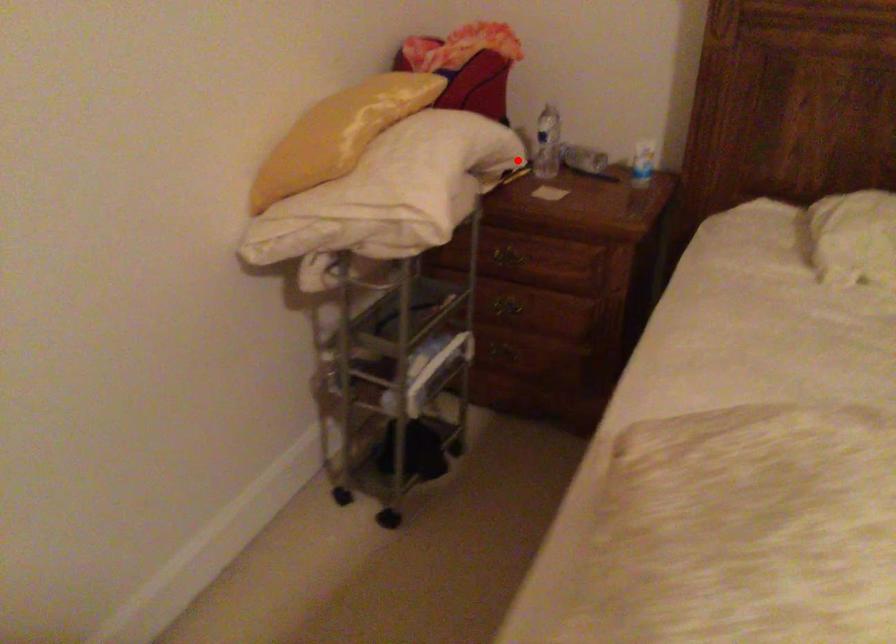
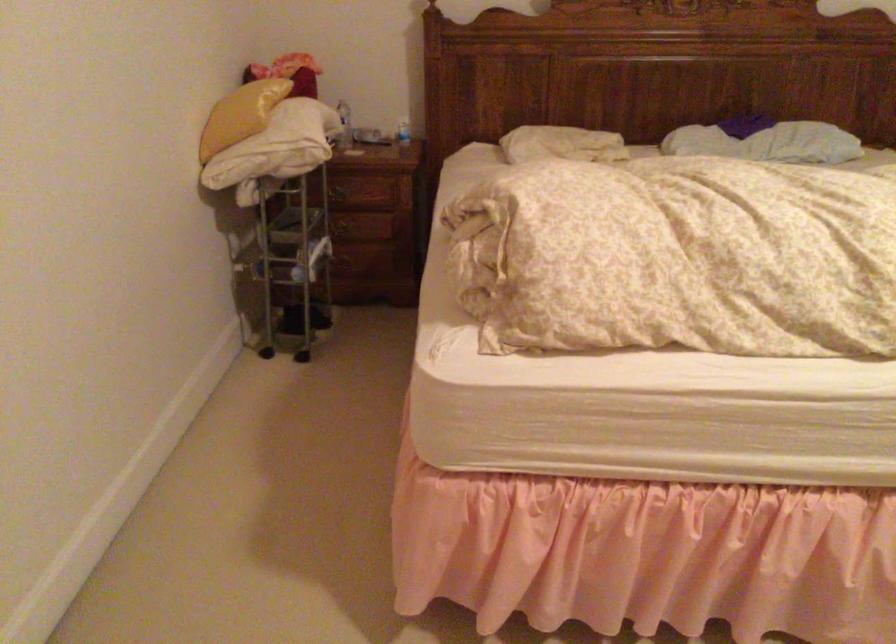
Where in the second image is the point corresponding to the highlighted location from the first image?

(343, 125)